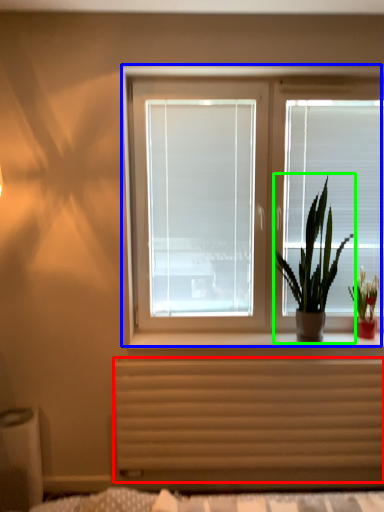
Question: Considering the real-world distances, which object is farthest from radiator (highlighted by a red box)? window (highlighted by a blue box) or houseplant (highlighted by a green box)?

Choices:
 (A) window
 (B) houseplant

Answer: (A)